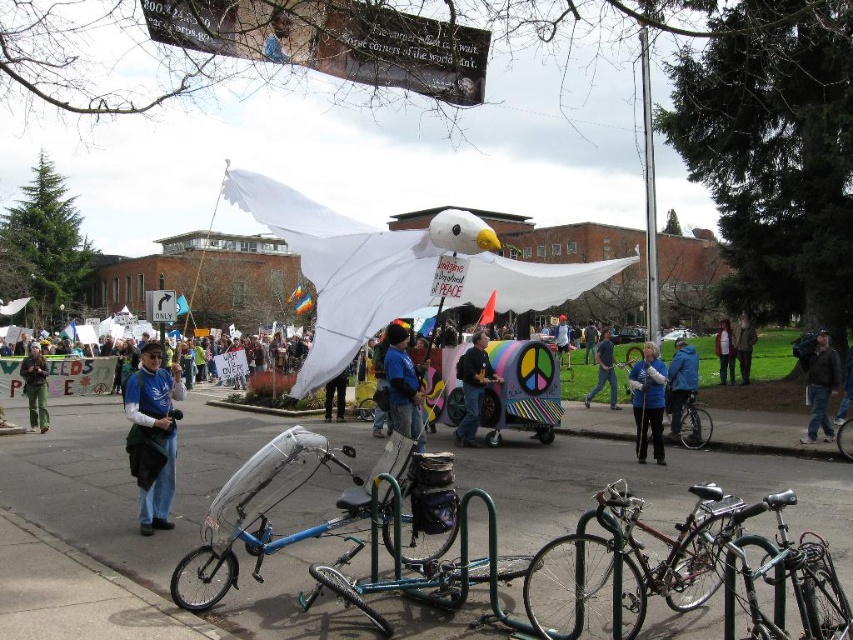
You are a photographer trying to capture a clear photo of the blue fabric jacket at center without the shiny black bicycle at lower right blocking it. What should you do?

Move to the side so that the shiny black bicycle at lower right is no longer in front of the blue fabric jacket at center.

You are a photographer trying to capture both the blue jacket at center and the denim jacket at center in a single frame. Since you want to highlight the smaller jacket, which one should you focus on to ensure it stands out more against the large inflatable bird?

The blue jacket at center has a lesser width compared to denim jacket at center, so focusing on the blue jacket at center will make it appear smaller and more distinct against the large inflatable bird.